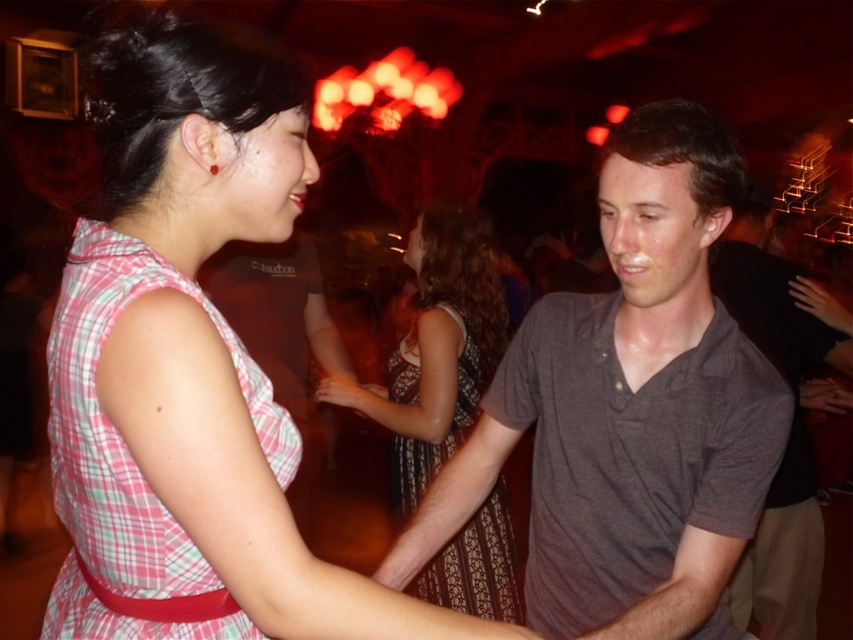
Question: Based on their relative distances, which object is nearer to the pink plaid dress at center?

Choices:
 (A) gray cotton shirt at center
 (B) dark gray cotton shirt at center

Answer: (A)

Question: Does pink plaid dress at center have a greater width compared to patterned fabric dress at center?

Choices:
 (A) no
 (B) yes

Answer: (B)

Question: Does pink plaid dress at center appear on the right side of gray cotton shirt at center?

Choices:
 (A) no
 (B) yes

Answer: (A)

Question: Where is gray cotton shirt at center located in relation to patterned fabric dress at center in the image?

Choices:
 (A) below
 (B) above

Answer: (B)

Question: Which point appears closest to the camera in this image?

Choices:
 (A) (119, 225)
 (B) (776, 604)

Answer: (A)

Question: Considering the real-world distances, which object is farthest from the patterned fabric dress at center?

Choices:
 (A) pink plaid dress at left
 (B) pink plaid dress at center
 (C) dark gray cotton shirt at center
 (D) gray cotton shirt at center

Answer: (B)